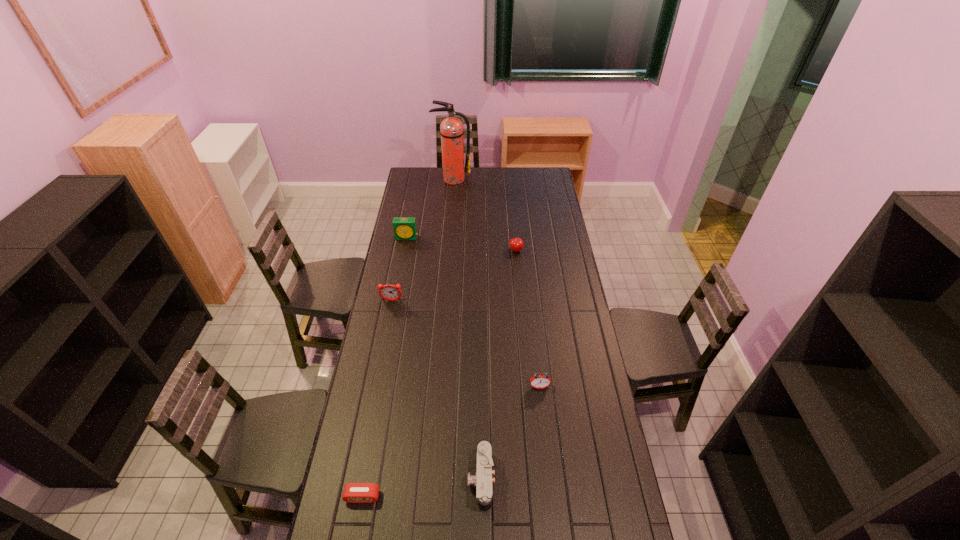
Locate an element on the screen. free space in the image that satisfies the following two spatial constraints: 1. at the nozzle of the cherry; 2. on the left side of the farthest object is located at coordinates (446, 251).